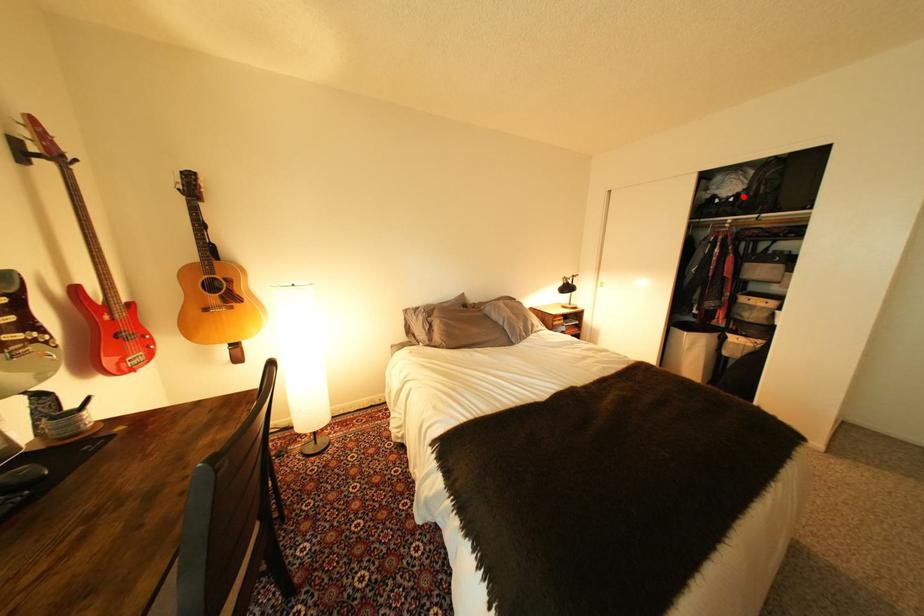
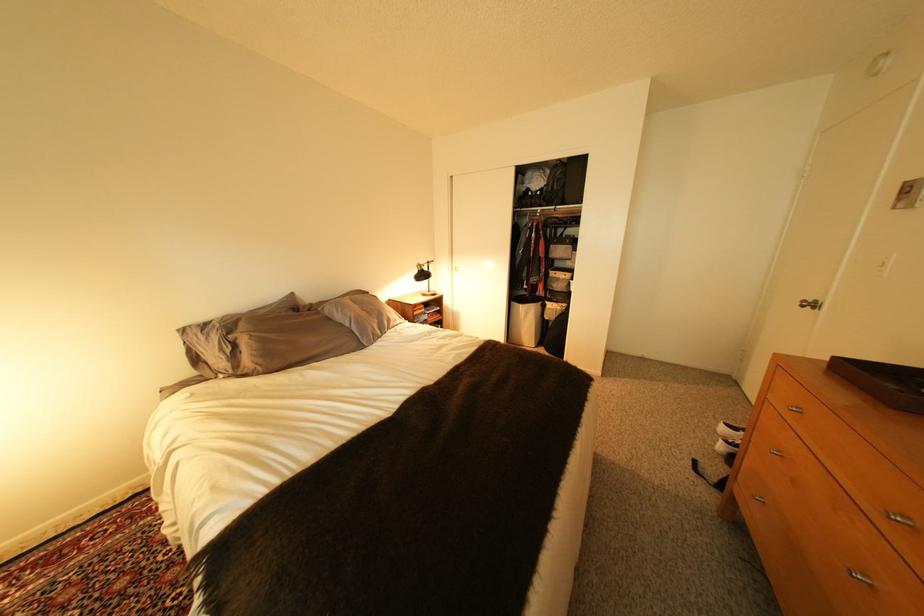
Where in the second image is the point corresponding to the highlighted location from the first image?

(550, 191)